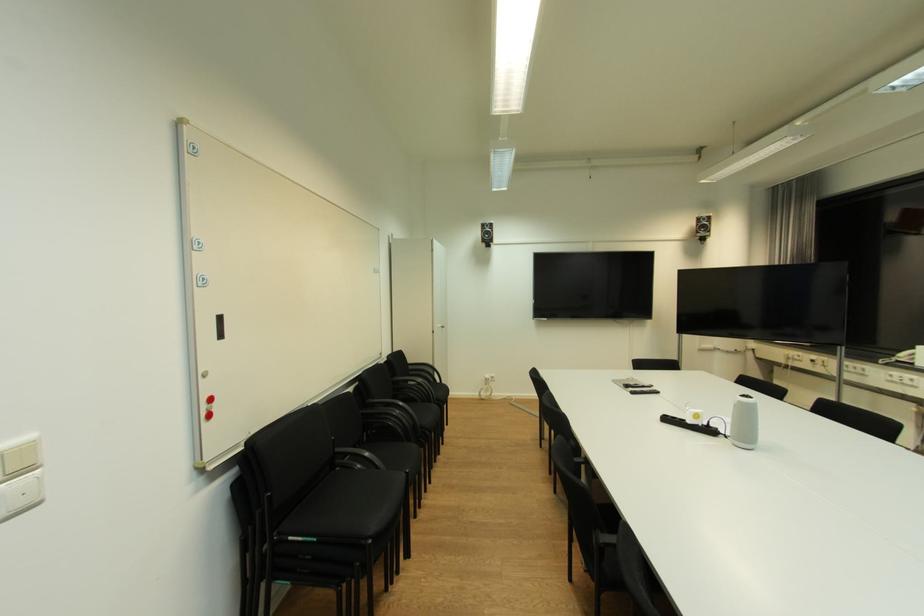
The image size is (924, 616). Identify the location of red whiteboard magnet. (209, 408).